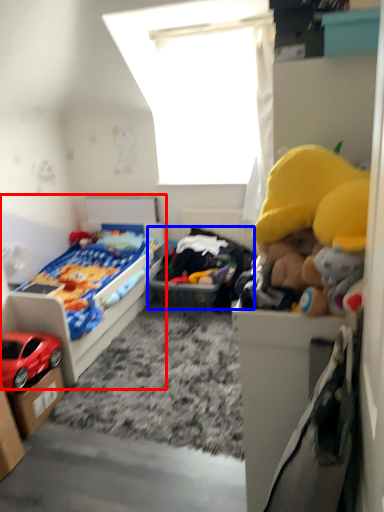
Question: Which object appears closest to the camera in this image, bed (highlighted by a red box) or toy (highlighted by a blue box)?

Choices:
 (A) bed
 (B) toy

Answer: (A)